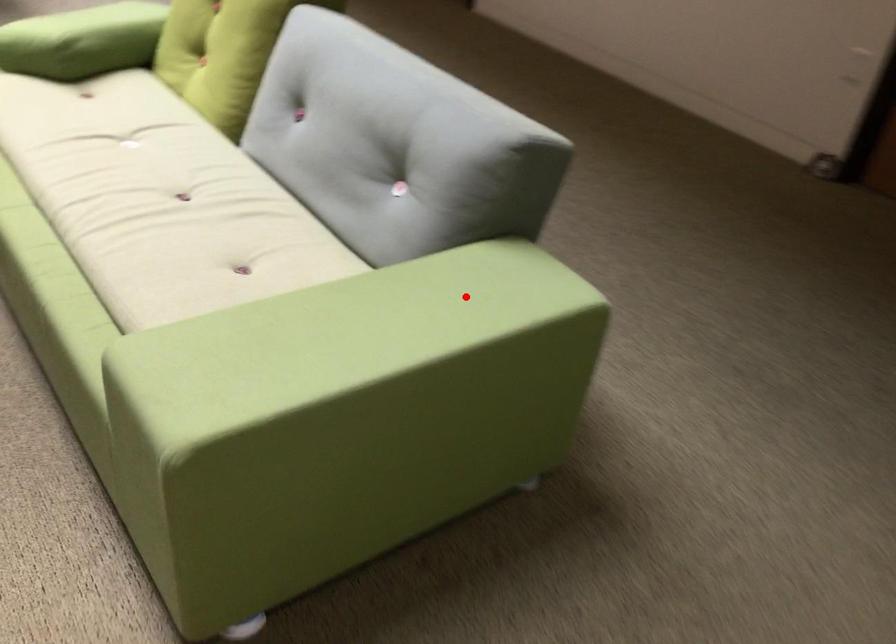
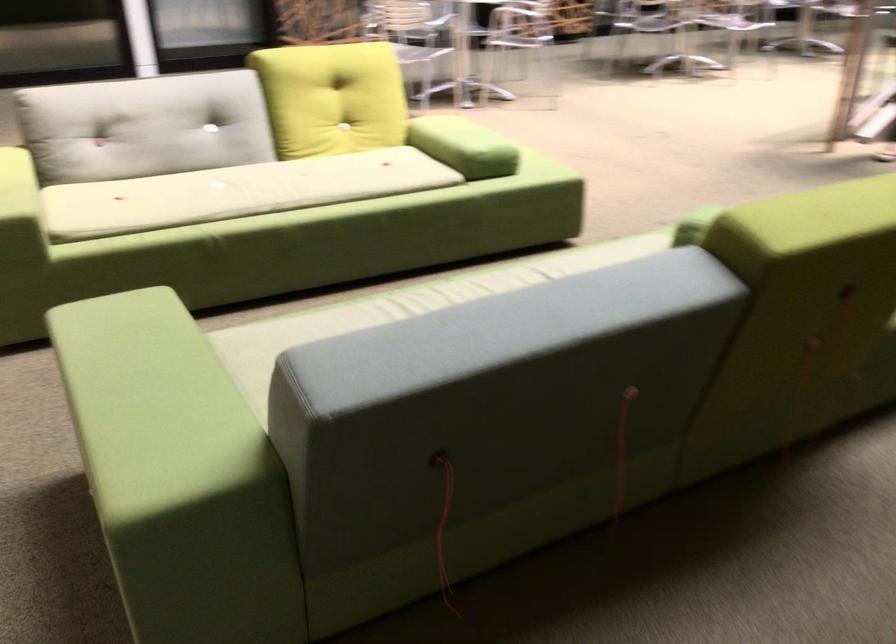
Where in the second image is the point corresponding to the highlighted location from the first image?

(151, 404)